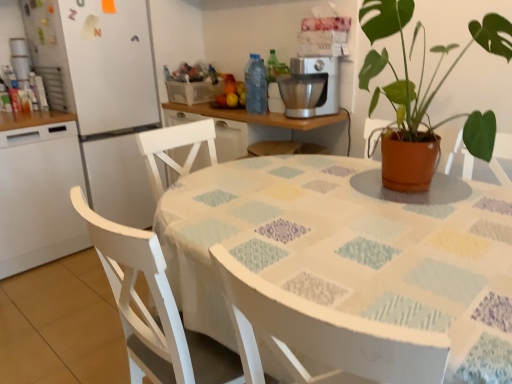
The image size is (512, 384). What do you see at coordinates (255, 85) in the screenshot? I see `transparent plastic bottle at center` at bounding box center [255, 85].

Identify the location of white matte refrigerator at left. (103, 93).

This screenshot has width=512, height=384. Describe the element at coordinates (425, 91) in the screenshot. I see `terracotta pot at upper right` at that location.

Where is `transparent plastic bottle at center`? Image resolution: width=512 pixels, height=384 pixels. transparent plastic bottle at center is located at coordinates (255, 85).

In the image, is satin silver mixer at upper center on the left side or the right side of white matte refrigerator at left?

satin silver mixer at upper center is to the right of white matte refrigerator at left.

Is the surface of satin silver mixer at upper center in direct contact with white matte refrigerator at left?

No, satin silver mixer at upper center is not touching white matte refrigerator at left.

Does satin silver mixer at upper center turn towards white matte refrigerator at left?

No, satin silver mixer at upper center is not facing towards white matte refrigerator at left.

From a real-world perspective, is satin silver mixer at upper center positioned above or below white matte refrigerator at left?

satin silver mixer at upper center is above white matte refrigerator at left.

Can transparent plastic bottle at center be found inside white wood chair at lower left?

No, transparent plastic bottle at center is located outside of white wood chair at lower left.

Which object is positioned more to the right, white wood chair at lower left or transparent plastic bottle at center?

transparent plastic bottle at center is more to the right.

Does point (134, 273) lie in front of point (247, 82)?

Yes, it is.

Is white wood chair at lower left beside transparent plastic bottle at center?

white wood chair at lower left and transparent plastic bottle at center are not in contact.

Based on the photo, is transparent plastic bottle at center positioned far away from white glossy refrigerator at left?

Yes.

Does point (256, 82) come farther from viewer compared to point (63, 222)?

No.

Which of these two, transparent plastic bottle at center or white glossy refrigerator at left, is thinner?

Thinner between the two is transparent plastic bottle at center.

Can you confirm if white wood chair at lower left is shorter than white matte refrigerator at left?

Indeed, white wood chair at lower left has a lesser height compared to white matte refrigerator at left.

From the image's perspective, which one is positioned higher, white wood chair at lower left or white matte refrigerator at left?

white matte refrigerator at left appears higher in the image.

How many degrees apart are the facing directions of white wood chair at lower left and white matte refrigerator at left?

92.9 degrees separate the facing orientations of white wood chair at lower left and white matte refrigerator at left.

Is satin silver mixer at upper center positioned with its back to terracotta pot at upper right?

That's not correct — satin silver mixer at upper center is not looking away from terracotta pot at upper right.

From a real-world perspective, is satin silver mixer at upper center physically above terracotta pot at upper right?

No.

Is satin silver mixer at upper center far from terracotta pot at upper right?

No, there isn't a large distance between satin silver mixer at upper center and terracotta pot at upper right.

Does satin silver mixer at upper center have a smaller size compared to terracotta pot at upper right?

Yes.

Relative to white painted wood table at center, is terracotta pot at upper right in front or behind?

terracotta pot at upper right is behind white painted wood table at center.

Is terracotta pot at upper right positioned with its back to white painted wood table at center?

terracotta pot at upper right does not have its back to white painted wood table at center.

Considering the sizes of objects terracotta pot at upper right and white painted wood table at center in the image provided, who is thinner, terracotta pot at upper right or white painted wood table at center?

With smaller width is terracotta pot at upper right.

Which is in front, point (326, 93) or point (490, 294)?

The point (490, 294) is in front.

Would you say white painted wood table at center is part of satin silver mixer at upper center's contents?

No, satin silver mixer at upper center does not contain white painted wood table at center.

In terms of size, does satin silver mixer at upper center appear bigger or smaller than white painted wood table at center?

Clearly, satin silver mixer at upper center is smaller in size than white painted wood table at center.

Find the location of a particular element. The image size is (512, 384). coffee machine on the right of white painted wood table at center is located at coordinates tap(310, 87).

At what (x,y) coordinates should I click in order to perform the action: click on coffee machine located in front of the white matte refrigerator at left. Please return your answer as a coordinate pair (x, y). The width and height of the screenshot is (512, 384). Looking at the image, I should click on (310, 87).

I want to click on chair below the transparent plastic bottle at center (from the image's perspective), so click(x=158, y=310).

Based on their spatial positions, is white matte refrigerator at left or white painted wood table at center further from white wood chair at lower left?

white matte refrigerator at left is further to white wood chair at lower left.

Based on the photo, estimate the real-world distances between objects in this image. Which object is closer to terracotta pot at upper right, white matte refrigerator at left or white painted wood table at center?

white painted wood table at center lies closer to terracotta pot at upper right than the other object.

From the image, which object appears to be farther from satin silver mixer at upper center, terracotta pot at upper right or white wood chair at lower left?

white wood chair at lower left is positioned further to the anchor satin silver mixer at upper center.

Which object lies nearer to the anchor point white glossy refrigerator at left, white painted wood table at center or transparent plastic bottle at center?

The object closer to white glossy refrigerator at left is transparent plastic bottle at center.

Looking at the image, which one is located further to white glossy refrigerator at left, white matte refrigerator at left or white wood chair at lower left?

white wood chair at lower left is positioned further to the anchor white glossy refrigerator at left.

When comparing their distances from white matte refrigerator at left, does white painted wood table at center or white wood chair at lower left seem further?

white wood chair at lower left is further to white matte refrigerator at left.

Which object lies nearer to the anchor point satin silver mixer at upper center, white painted wood table at center or white glossy refrigerator at left?

Based on the image, white painted wood table at center appears to be nearer to satin silver mixer at upper center.

Which object lies nearer to the anchor point white glossy refrigerator at left, transparent plastic bottle at center or white wood chair at lower left?

transparent plastic bottle at center lies closer to white glossy refrigerator at left than the other object.

Locate an element on the screen. This screenshot has height=384, width=512. table between terracotta pot at upper right and white wood chair at lower left vertically is located at coordinates (349, 250).

Find the location of `bottle between white wood chair at lower left and white matte refrigerator at left from front to back`. bottle between white wood chair at lower left and white matte refrigerator at left from front to back is located at coordinates (255, 85).

Image resolution: width=512 pixels, height=384 pixels. I want to click on bottle between white matte refrigerator at left and satin silver mixer at upper center in the horizontal direction, so click(255, 85).

The image size is (512, 384). Find the location of `table between white glossy refrigerator at left and terracotta pot at upper right in the horizontal direction`. table between white glossy refrigerator at left and terracotta pot at upper right in the horizontal direction is located at coordinates (349, 250).